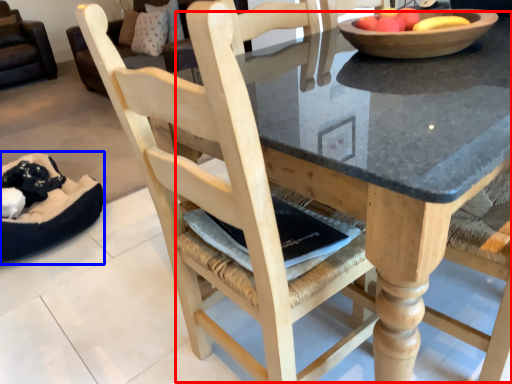
Question: Which point is further to the camera, round table (highlighted by a red box) or bean bag chair (highlighted by a blue box)?

Choices:
 (A) round table
 (B) bean bag chair

Answer: (B)